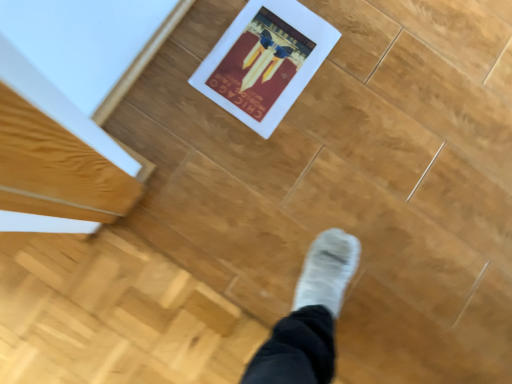
The width and height of the screenshot is (512, 384). In order to click on free space above white matte picture frame at center (from a real-world perspective) in this screenshot , I will do `click(265, 61)`.